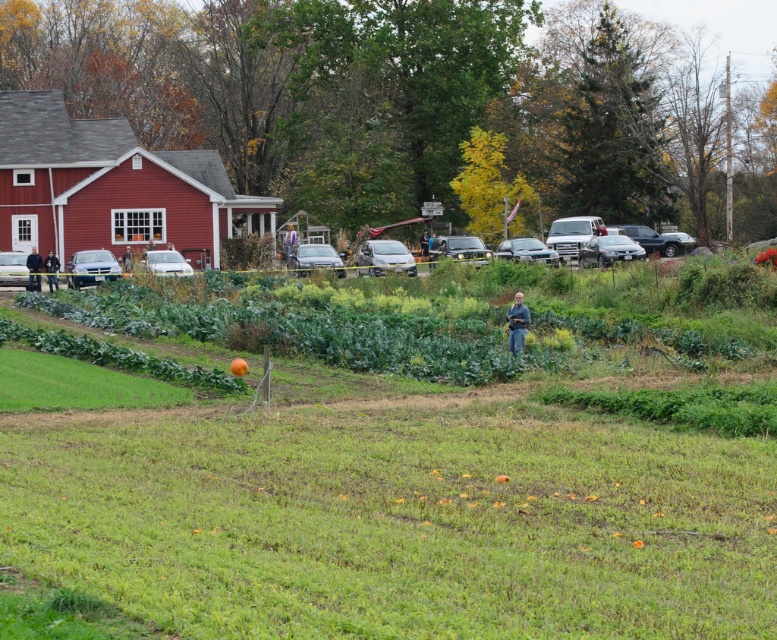
Is point (187, 289) in front of point (54, 266)?

Yes, it is in front of point (54, 266).

Between green grassy field at center and blue jeans at left, which one appears on the left side from the viewer's perspective?

From the viewer's perspective, blue jeans at left appears more on the left side.

The height and width of the screenshot is (640, 777). What do you see at coordinates (413, 464) in the screenshot?
I see `green grassy field at center` at bounding box center [413, 464].

Identify the location of green grassy field at center. (413, 464).

Can you confirm if dark blue jeans at center is wider than blue jeans at left?

In fact, dark blue jeans at center might be narrower than blue jeans at left.

Who is more distant from viewer, (40,260) or (47,285)?

Point (40,260)

Where is `dark blue jeans at center`? This screenshot has height=640, width=777. dark blue jeans at center is located at coordinates (33, 269).

Which of these two, blue jeans at center or dark blue jeans at center, stands taller?

With more height is dark blue jeans at center.

In the scene shown: Can you confirm if blue jeans at center is smaller than dark blue jeans at center?

Yes.

Is point (511, 310) farther from viewer compared to point (26, 285)?

That is False.

Where is `blue jeans at center`? blue jeans at center is located at coordinates (517, 323).